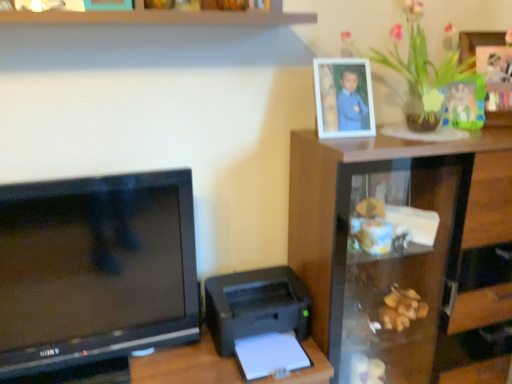
Question: Could you tell me if green leafy plant at upper right is facing white plastic picture frame at upper right?

Choices:
 (A) no
 (B) yes

Answer: (A)

Question: From a real-world perspective, is green leafy plant at upper right located beneath white plastic picture frame at upper right?

Choices:
 (A) yes
 (B) no

Answer: (B)

Question: Is green leafy plant at upper right smaller than white plastic picture frame at upper right?

Choices:
 (A) yes
 (B) no

Answer: (B)

Question: Considering the relative sizes of green leafy plant at upper right and white plastic picture frame at upper right in the image provided, is green leafy plant at upper right bigger than white plastic picture frame at upper right?

Choices:
 (A) yes
 (B) no

Answer: (A)

Question: From the image's perspective, is green leafy plant at upper right above white plastic picture frame at upper right?

Choices:
 (A) yes
 (B) no

Answer: (A)

Question: Is green leafy plant at upper right not near white plastic picture frame at upper right?

Choices:
 (A) no
 (B) yes

Answer: (A)

Question: From the image's perspective, is black glossy television at left above white plastic picture frame at upper right?

Choices:
 (A) yes
 (B) no

Answer: (B)

Question: Is black glossy television at left placed right next to white plastic picture frame at upper right?

Choices:
 (A) yes
 (B) no

Answer: (B)

Question: Is white plastic picture frame at upper right inside black glossy television at left?

Choices:
 (A) no
 (B) yes

Answer: (A)

Question: Considering the relative positions of black glossy television at left and white plastic picture frame at upper right in the image provided, is black glossy television at left to the left of white plastic picture frame at upper right from the viewer's perspective?

Choices:
 (A) no
 (B) yes

Answer: (B)

Question: Considering the relative sizes of black glossy television at left and white plastic picture frame at upper right in the image provided, is black glossy television at left taller than white plastic picture frame at upper right?

Choices:
 (A) no
 (B) yes

Answer: (B)

Question: From the image's perspective, does black glossy television at left appear lower than white plastic picture frame at upper right?

Choices:
 (A) yes
 (B) no

Answer: (A)

Question: Would you say green leafy plant at upper right contains black plastic printer at lower right?

Choices:
 (A) yes
 (B) no

Answer: (B)